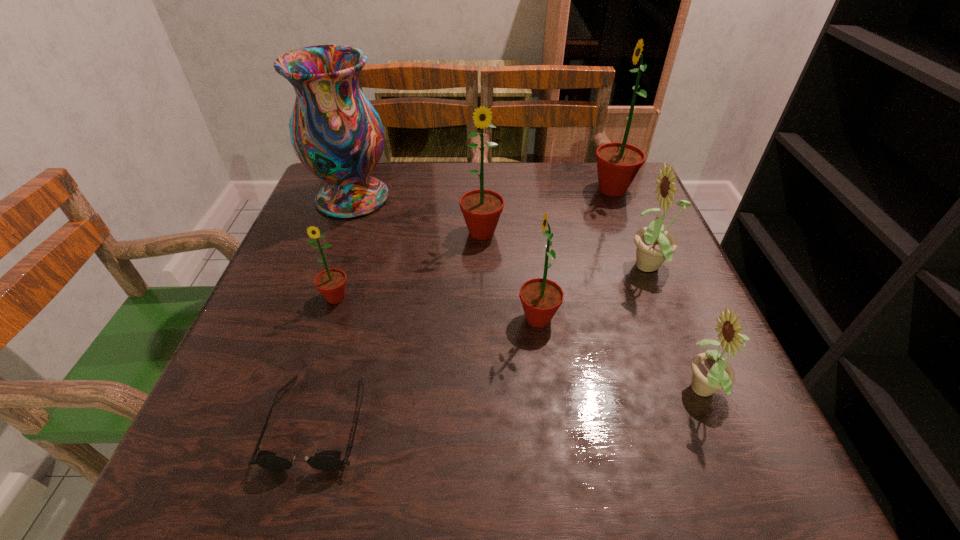
The width and height of the screenshot is (960, 540). I want to click on object that is positioned at the near edge, so click(329, 460).

Identify the location of vase that is at the left edge. The image size is (960, 540). (337, 134).

Locate an element on the screen. sunflower at the left edge is located at coordinates (331, 283).

Where is `sunglasses positioned at the left edge`? Image resolution: width=960 pixels, height=540 pixels. sunglasses positioned at the left edge is located at coordinates (329, 460).

At what (x,y) coordinates should I click in order to perform the action: click on object at the far left corner. Please return your answer as a coordinate pair (x, y). This screenshot has height=540, width=960. Looking at the image, I should click on (337, 134).

The image size is (960, 540). I want to click on object present at the near left corner, so click(329, 460).

Locate an element on the screen. object that is at the far right corner is located at coordinates (617, 163).

At what (x,y) coordinates should I click in order to perform the action: click on vacant space at the far edge of the desktop. Please return your answer as a coordinate pair (x, y). The height and width of the screenshot is (540, 960). Looking at the image, I should click on (469, 170).

Where is `vacant space at the near edge`? vacant space at the near edge is located at coordinates (591, 489).

At what (x,y) coordinates should I click in order to perform the action: click on free region at the left edge of the desktop. Please return your answer as a coordinate pair (x, y). The width and height of the screenshot is (960, 540). Looking at the image, I should click on (282, 274).